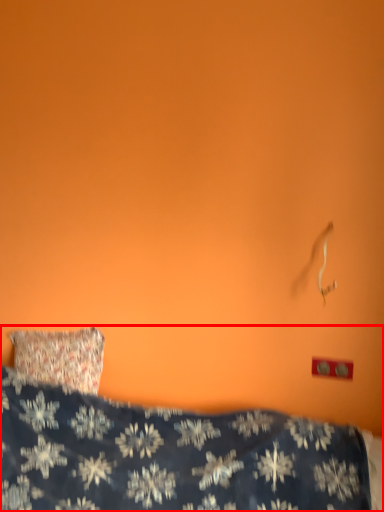
Question: From the image's perspective, where is bed (annotated by the red box) located in relation to electric outlet in the image?

Choices:
 (A) below
 (B) above

Answer: (A)